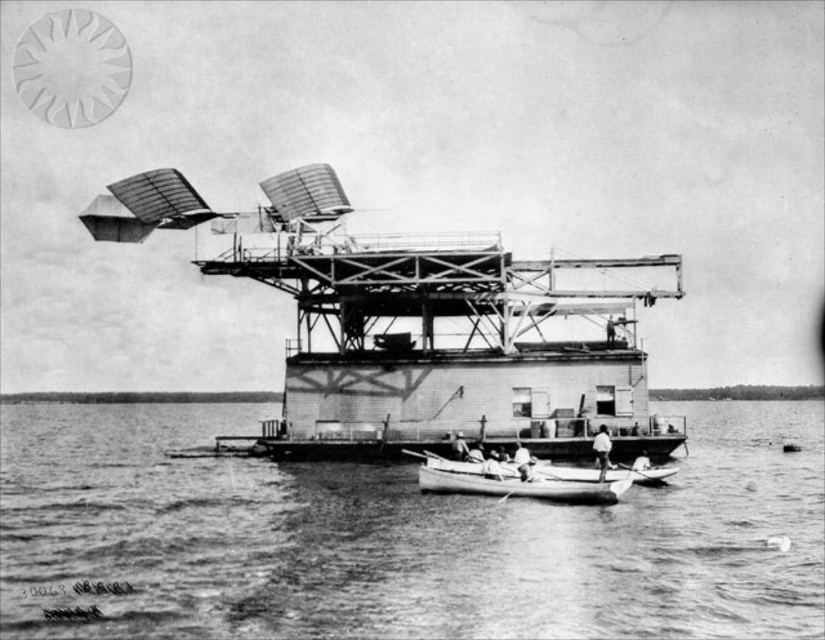
You are standing on the deck of the floating structure and see the smooth water at center and the smooth white canoe at center. Which object is located below the other?

The smooth water at center is positioned under the smooth white canoe at center, so the water is below the canoe.

You are standing on the deck of the floating structure and see the smooth water at center and the smooth white canoe at center. Which object is positioned to the left of the other?

The smooth water at center is to the left of the smooth white canoe at center.